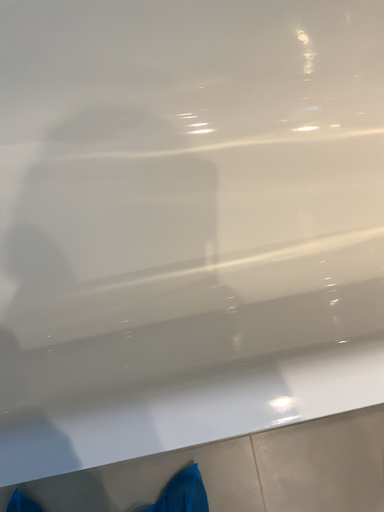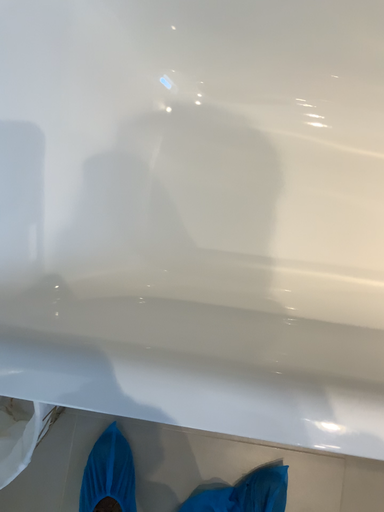
Question: Which way did the camera rotate in the video?

Choices:
 (A) rotated right
 (B) rotated left

Answer: (B)